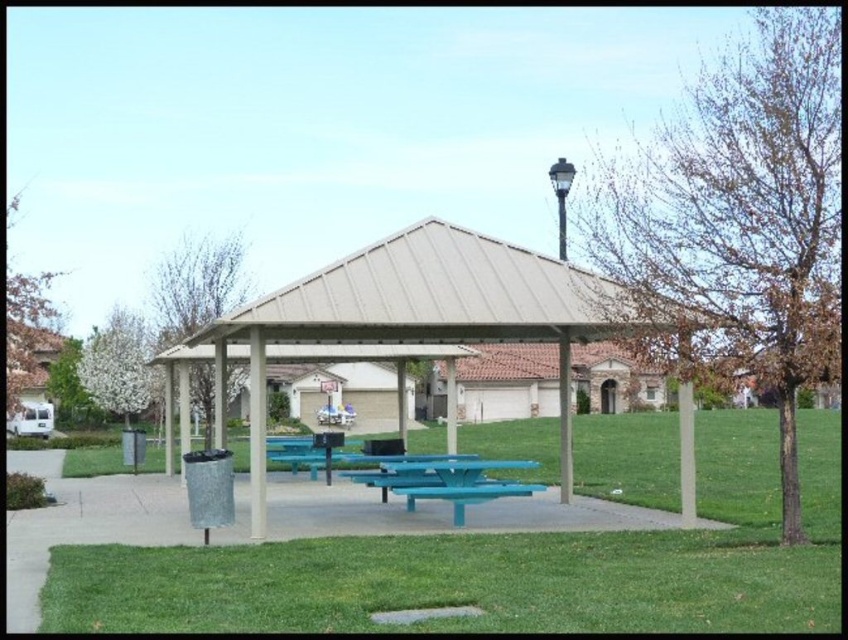
Who is taller, green grass at center or green grass at lower center?

green grass at center

How far apart are green grass at center and green grass at lower center?

green grass at center and green grass at lower center are 10.00 feet apart from each other.

Locate an element on the screen. green grass at center is located at coordinates (506, 564).

Consider the image. Which is below, green grass at lower center or green leafy tree at left?

green leafy tree at left

Who is more forward, (648, 545) or (70, 412)?

Point (648, 545) is more forward.

Does point (59, 621) lie in front of point (70, 378)?

Yes, it is in front of point (70, 378).

Image resolution: width=848 pixels, height=640 pixels. In order to click on green grass at lower center in this screenshot , I will do pos(452,582).

Who is taller, bare branches at upper left or brown leafy tree at upper left?

brown leafy tree at upper left is taller.

Between point (198, 250) and point (45, 326), which one is positioned in front?

Positioned in front is point (198, 250).

I want to click on bare branches at upper left, so (x=196, y=285).